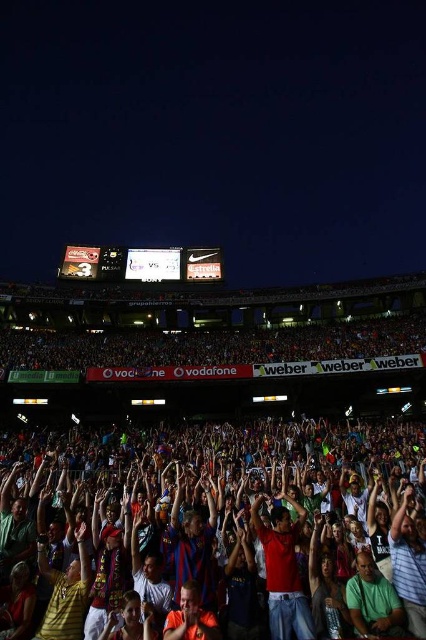
You are a drone operator trying to capture aerial footage of the multicolored fabric crowd at lower center. Your drone has a maximum flight range of 100 feet. Can you reach the crowd without exceeding the drone range limit?

The multicolored fabric crowd at lower center is 113.53 feet away, which exceeds the drone operator maximum flight range of 100 feet. The drone cannot reach the crowd without exceeding the range limit.

You are a photographer standing at the edge of the stadium, trying to capture a photo of the red cotton shirt at center. However, the multicolored fabric crowd at lower center is blocking your view. Can you move to the right to get a clear shot?

The multicolored fabric crowd at lower center is positioned on the left side of the red cotton shirt at center, so moving to the right should allow you to avoid the crowd and capture the red cotton shirt at center clearly.

You are a photographer standing at the edge of the stadium field. You want to take a photo of both the multicolored fabric crowd at lower center and the red cotton shirt at center. Which object is closer to you?

The multicolored fabric crowd at lower center is closer to you since it is only 9.62 meters away from the red cotton shirt at center, and since you are at the edge of the field, the crowd at lower center would be nearer.